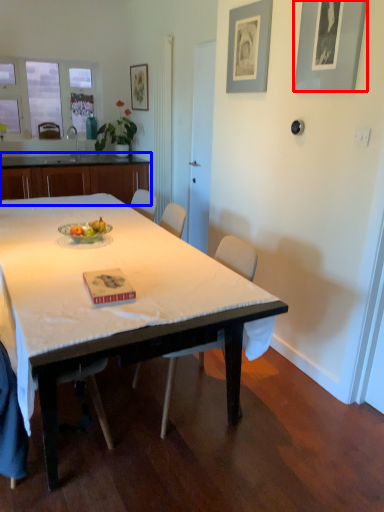
Question: Which point is closer to the camera, picture frame (highlighted by a red box) or cabinetry (highlighted by a blue box)?

Choices:
 (A) picture frame
 (B) cabinetry

Answer: (A)